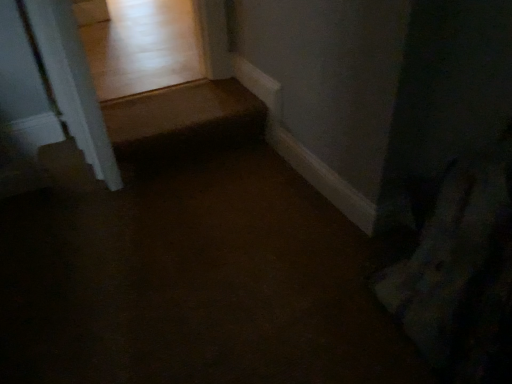
Question: From the image's perspective, is brown carpet at center located above or below white glossy door frame at upper left?

Choices:
 (A) below
 (B) above

Answer: (A)

Question: Does point 315,365 appear closer or farther from the camera than point 59,99?

Choices:
 (A) closer
 (B) farther

Answer: (A)

Question: In terms of width, does brown carpet at center look wider or thinner when compared to white glossy door frame at upper left?

Choices:
 (A) wide
 (B) thin

Answer: (A)

Question: Is white glossy door frame at upper left inside the boundaries of brown carpet at center, or outside?

Choices:
 (A) outside
 (B) inside

Answer: (A)

Question: Based on their positions, is white glossy door frame at upper left located to the left or right of brown carpet at center?

Choices:
 (A) left
 (B) right

Answer: (A)

Question: Is white glossy door frame at upper left in front of or behind brown carpet at center in the image?

Choices:
 (A) behind
 (B) front

Answer: (A)

Question: From the image's perspective, relative to brown carpet at center, is white glossy door frame at upper left above or below?

Choices:
 (A) above
 (B) below

Answer: (A)